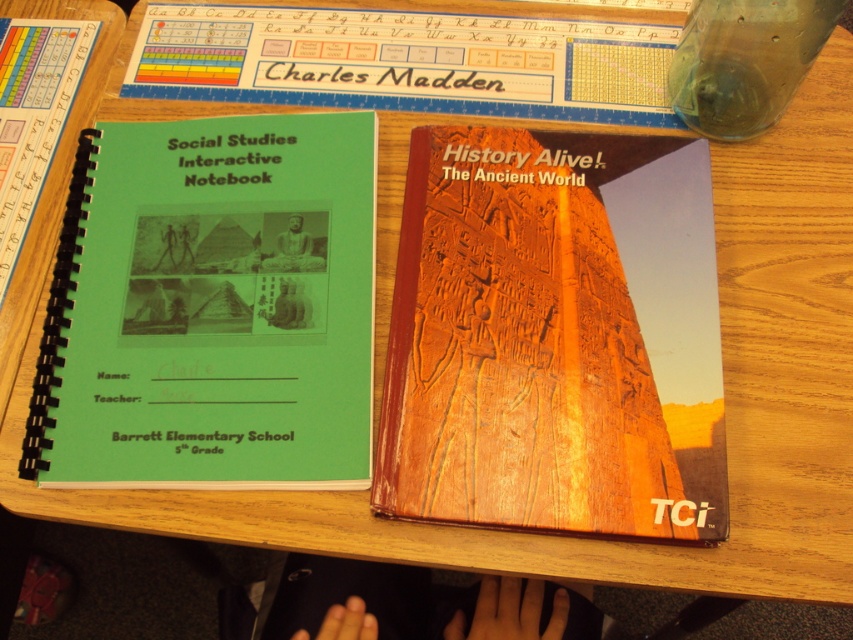
You are a student who needs to place both the wooden history alive! book at center and the green matte social studies interactive notebook at left into a backpack compartment that can only hold items up to the size of the smaller object. Which book should you leave behind?

The wooden history alive! book at center is bigger than the green matte social studies interactive notebook at left, so you should leave the wooden history alive! book at center behind.

From the picture: Based on the scene description, where is the wooden history alive! book at center located in terms of its 2D coordinates?

The wooden history alive! book at center is located at coordinates [555,337].